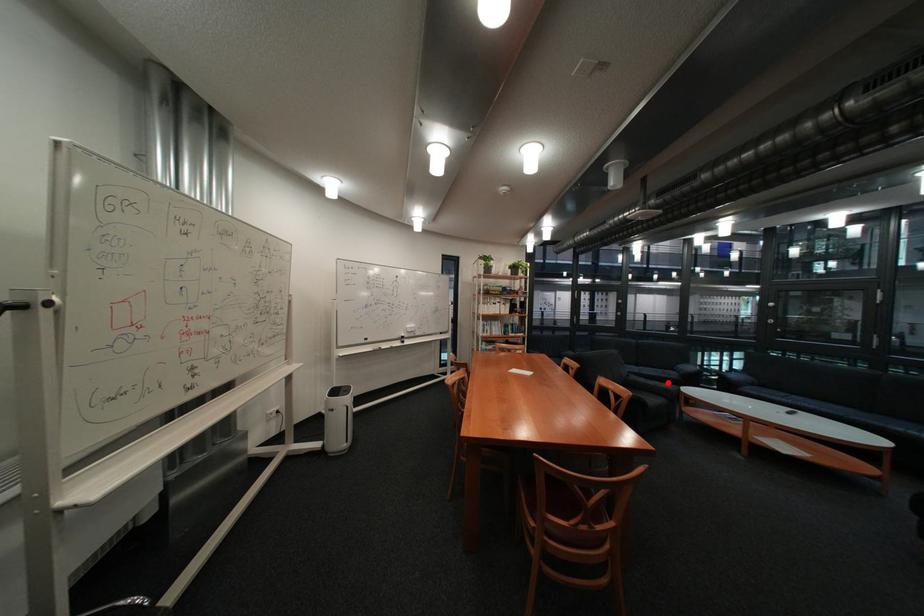
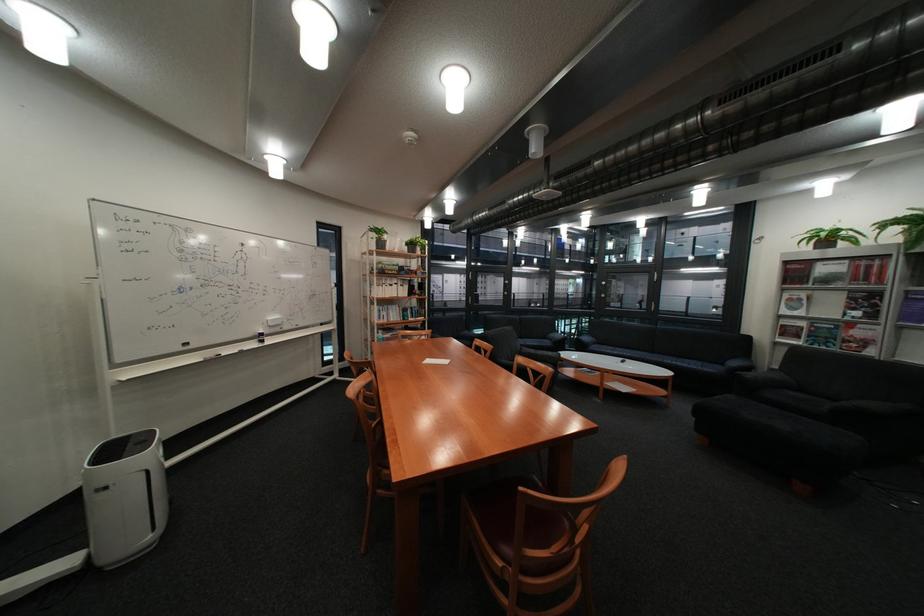
Locate, in the second image, the point that corresponds to the highlighted location in the first image.

(555, 353)